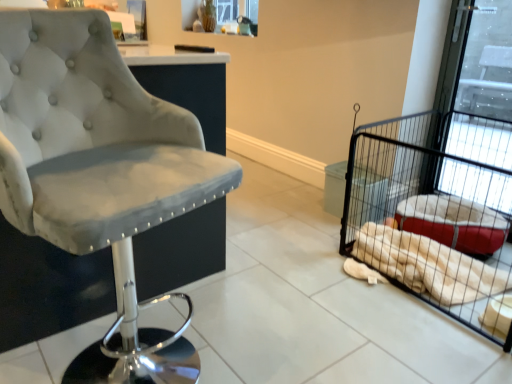
In order to click on black wire pet cage at right in this screenshot , I will do `click(433, 218)`.

The width and height of the screenshot is (512, 384). Identify the location of black wire pet cage at right. (433, 218).

Could you tell me if velvet grey chair at left is facing white plush blanket at right?

No.

Considering the relative positions of velvet grey chair at left and white plush blanket at right in the image provided, is velvet grey chair at left to the left or to the right of white plush blanket at right?

Clearly, velvet grey chair at left is on the left of white plush blanket at right in the image.

Considering the relative sizes of velvet grey chair at left and white plush blanket at right in the image provided, is velvet grey chair at left taller than white plush blanket at right?

Correct, velvet grey chair at left is much taller as white plush blanket at right.

Looking at this image, can we say velvet grey chair at left lies outside white plush blanket at right?

velvet grey chair at left lies outside white plush blanket at right's area.

Can we say black wire pet cage at right lies outside velvet grey chair at left?

Yes, black wire pet cage at right is located beyond the bounds of velvet grey chair at left.

Can you confirm if black wire pet cage at right is bigger than velvet grey chair at left?

Indeed, black wire pet cage at right has a larger size compared to velvet grey chair at left.

You are a GUI agent. You are given a task and a screenshot of the screen. Output one action in this format:
    pyautogui.click(x=<x>, y=<y>)
    Task: Click on the bird cage on the right of velvet grey chair at left
    
    Given the screenshot: What is the action you would take?
    pyautogui.click(x=433, y=218)

Is the depth of white plush blanket at right greater than that of velvet grey chair at left?

Yes, the depth of white plush blanket at right is greater than that of velvet grey chair at left.

Is white plush blanket at right positioned with its back to velvet grey chair at left?

white plush blanket at right does not have its back to velvet grey chair at left.

How far apart are white plush blanket at right and velvet grey chair at left?

A distance of 3.85 feet exists between white plush blanket at right and velvet grey chair at left.

Where is `chair in front of the white plush blanket at right`? Image resolution: width=512 pixels, height=384 pixels. chair in front of the white plush blanket at right is located at coordinates (99, 173).

Which is farther, (411, 278) or (481, 214)?

The point (481, 214) is farther.

Considering the sizes of objects white plush blanket at right and black wire pet cage at right in the image provided, who is taller, white plush blanket at right or black wire pet cage at right?

black wire pet cage at right is taller.

Where is `material behind the black wire pet cage at right`? material behind the black wire pet cage at right is located at coordinates (428, 265).

From the image's perspective, is white plush blanket at right on top of black wire pet cage at right?

Incorrect, from the image's perspective, white plush blanket at right is lower than black wire pet cage at right.

From the image's perspective, is velvet grey chair at left located beneath black wire pet cage at right?

No, from the image's perspective, velvet grey chair at left is not beneath black wire pet cage at right.

Based on the photo, does velvet grey chair at left have a larger size compared to black wire pet cage at right?

No.

Is velvet grey chair at left facing towards black wire pet cage at right?

No.

From a real-world perspective, does velvet grey chair at left stand above black wire pet cage at right?

Yes, from a real-world perspective, velvet grey chair at left is above black wire pet cage at right.

From the image's perspective, between black wire pet cage at right and white plush blanket at right, who is located below?

white plush blanket at right, from the image's perspective.

Who is bigger, black wire pet cage at right or white plush blanket at right?

With larger size is black wire pet cage at right.

Is the surface of black wire pet cage at right in direct contact with white plush blanket at right?

No, black wire pet cage at right is not in contact with white plush blanket at right.

Visually, is black wire pet cage at right positioned to the left or to the right of white plush blanket at right?

black wire pet cage at right is positioned on white plush blanket at right's right side.

The image size is (512, 384). I want to click on material lying behind the velvet grey chair at left, so click(x=428, y=265).

There is a black wire pet cage at right. Where is `chair above it (from a real-world perspective)`? chair above it (from a real-world perspective) is located at coordinates (99, 173).

Based on their spatial positions, is black wire pet cage at right or velvet grey chair at left closer to white plush blanket at right?

Among the two, black wire pet cage at right is located nearer to white plush blanket at right.

Which object lies further to the anchor point velvet grey chair at left, white plush blanket at right or black wire pet cage at right?

black wire pet cage at right lies further to velvet grey chair at left than the other object.

Consider the image. When comparing their distances from velvet grey chair at left, does black wire pet cage at right or white plush blanket at right seem closer?

The object closer to velvet grey chair at left is white plush blanket at right.

Considering their positions, is velvet grey chair at left positioned closer to white plush blanket at right than black wire pet cage at right?

black wire pet cage at right is closer to white plush blanket at right.

Consider the image. Considering their positions, is velvet grey chair at left positioned closer to black wire pet cage at right than white plush blanket at right?

white plush blanket at right is positioned closer to the anchor black wire pet cage at right.

In the scene shown: Considering their positions, is white plush blanket at right positioned closer to black wire pet cage at right than velvet grey chair at left?

The object closer to black wire pet cage at right is white plush blanket at right.

Identify the location of material between velvet grey chair at left and black wire pet cage at right from left to right. Image resolution: width=512 pixels, height=384 pixels. (428, 265).